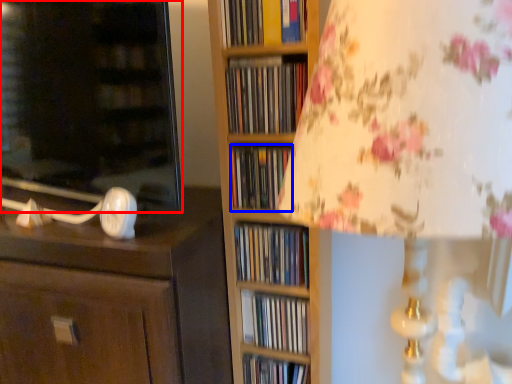
Question: Which point is closer to the camera, cabinetry (highlighted by a red box) or book (highlighted by a blue box)?

Choices:
 (A) cabinetry
 (B) book

Answer: (A)